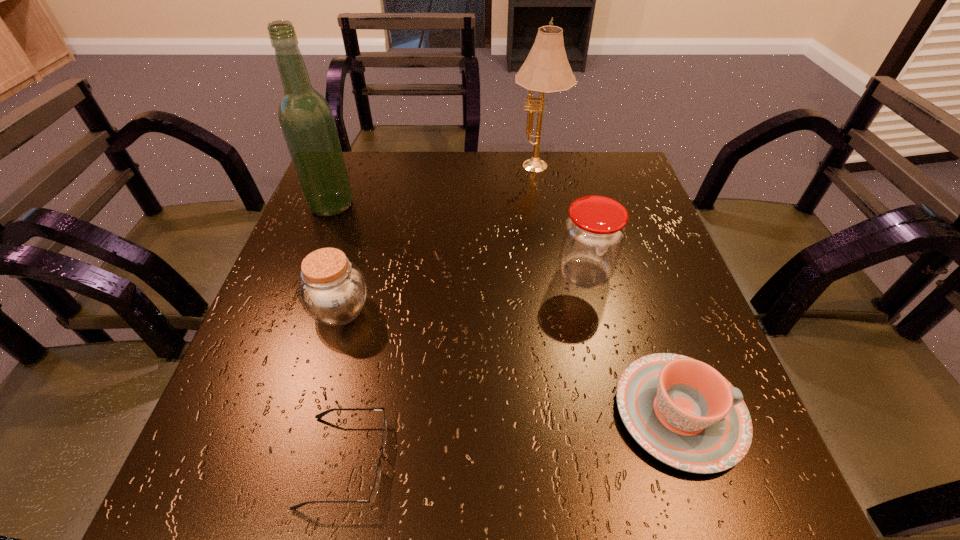
Find the location of a particular element. vacant area situated on the front of the taller jar is located at coordinates (607, 373).

Where is `free space located 0.080m on the front of the left jar`? free space located 0.080m on the front of the left jar is located at coordinates tap(323, 374).

Locate an element on the screen. The image size is (960, 540). vacant space located 0.160m on the front-facing side of the shortest object is located at coordinates (493, 461).

The image size is (960, 540). Identify the location of liquor that is at the far edge. (306, 119).

At what (x,y) coordinates should I click in order to perform the action: click on lampshade that is at the far edge. Please return your answer as a coordinate pair (x, y). This screenshot has width=960, height=540. Looking at the image, I should click on (546, 70).

I want to click on chinaware that is at the near edge, so click(x=683, y=412).

You are a GUI agent. You are given a task and a screenshot of the screen. Output one action in this format:
    pyautogui.click(x=<x>, y=<y>)
    Task: Click on the spectacles that is at the near edge
    The width and height of the screenshot is (960, 540).
    Given the screenshot: What is the action you would take?
    pyautogui.click(x=375, y=488)

Find the location of `liquor that is at the left edge`. liquor that is at the left edge is located at coordinates (306, 119).

What are the coordinates of `jar that is at the left edge` in the screenshot? It's located at (333, 291).

The width and height of the screenshot is (960, 540). I want to click on spectacles located in the left edge section of the desktop, so click(375, 488).